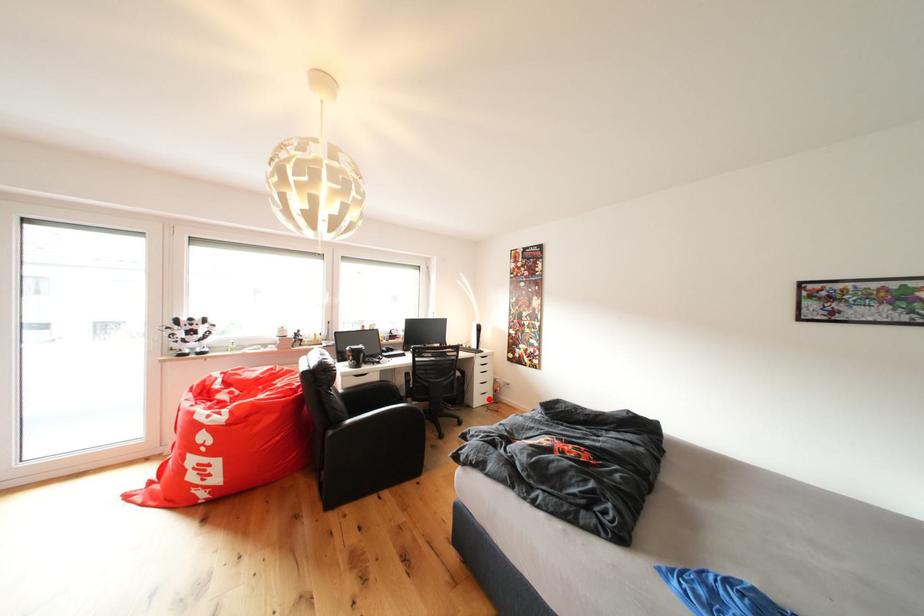
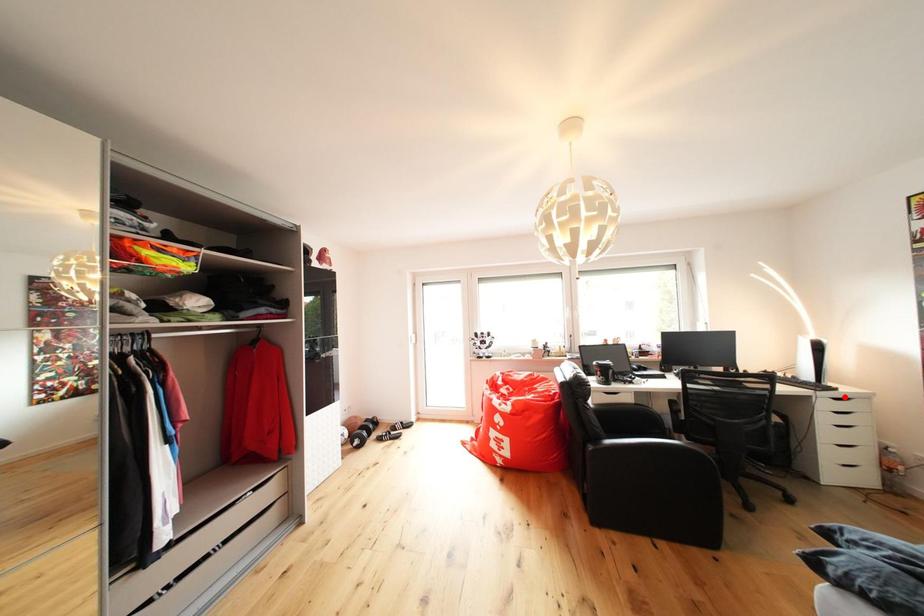
I am providing you with two images of the same scene from different viewpoints. A red point is marked on the first image and another point is marked on the second image. Do the highlighted points in image1 and image2 indicate the same real-world spot?

No